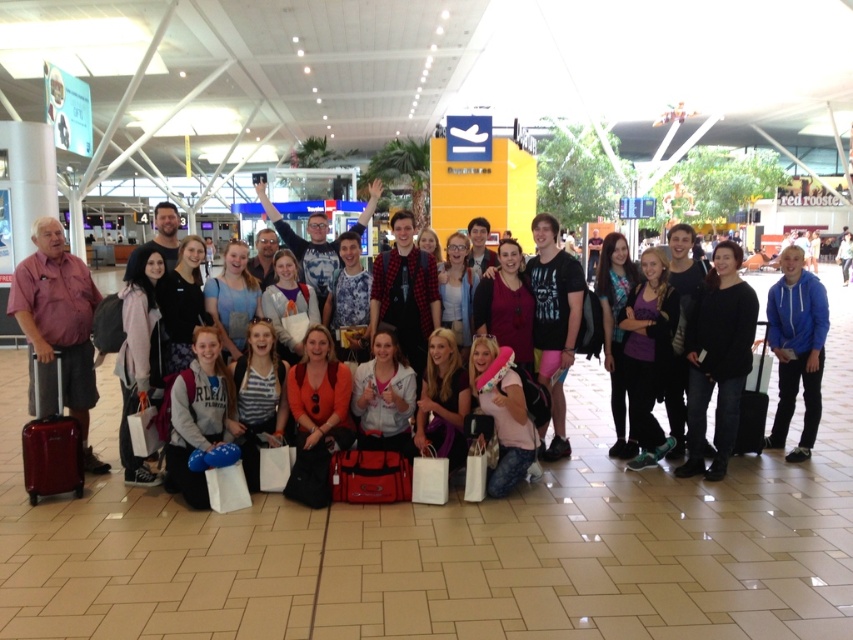
Is matte pink shirt at left wider than matte pink hoodie at center?

Yes.

Does matte pink shirt at left come behind matte pink hoodie at center?

No, it is not.

Locate an element on the screen. This screenshot has height=640, width=853. matte pink shirt at left is located at coordinates coord(57,324).

Is black matte jacket at center wider than purple matte shirt at center?

Yes.

Is point (717, 268) closer to camera compared to point (656, 440)?

Yes, point (717, 268) is closer to viewer.

Which is in front, point (730, 289) or point (642, 380)?

Point (730, 289)

You are a GUI agent. You are given a task and a screenshot of the screen. Output one action in this format:
    pyautogui.click(x=<x>, y=<y>)
    Task: Click on the black matte jacket at center
    This screenshot has width=853, height=640.
    Given the screenshot: What is the action you would take?
    pyautogui.click(x=717, y=358)

Which is above, black matte jacket at center or white fleece jacket at center?

black matte jacket at center

Is black matte jacket at center smaller than white fleece jacket at center?

Result: Incorrect, black matte jacket at center is not smaller in size than white fleece jacket at center.

The width and height of the screenshot is (853, 640). What are the coordinates of `black matte jacket at center` in the screenshot? It's located at (717, 358).

Where is `black matte jacket at center`? black matte jacket at center is located at coordinates (717, 358).